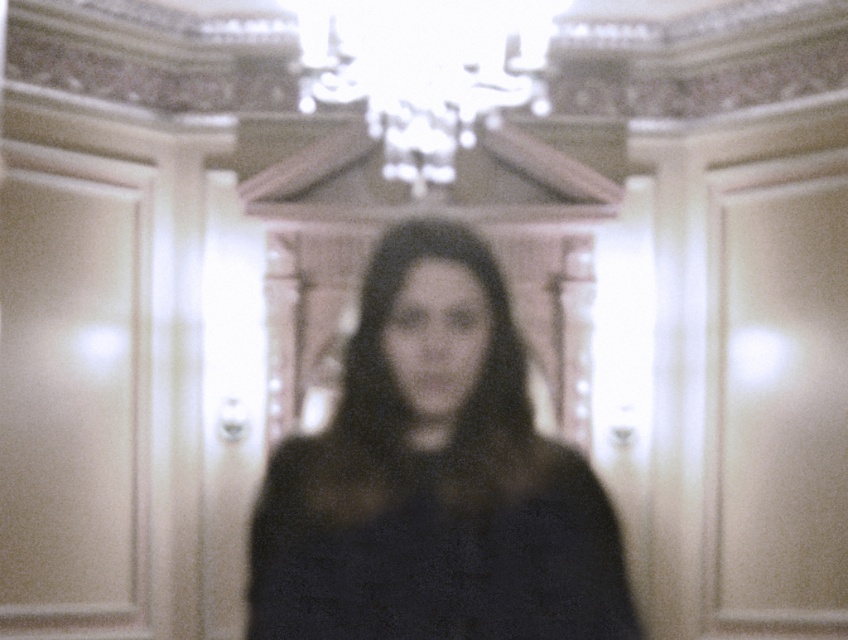
You are a fashion designer observing the image. You need to determine if the black matte dress at center can be displayed under the white glass chandelier at upper center without touching it. The minimum required distance between the dress and the chandelier is 1 meter. Can you confirm if this requirement is met?

The black matte dress at center has a lesser width compared to white glass chandelier at upper center. However, the description does not provide information about the distance between them. Therefore, it is impossible to confirm if the 1 meter requirement is met based on the given details.

You are a photographer trying to capture a clear shot of the black matte dress at center. The camera you are using has a maximum focus range of 20 meters. Can you successfully focus on the dress?

The black matte dress at center and camera are 20.91 meters apart, which exceeds the camera maximum focus range of 20 meters. Therefore, the camera cannot focus on the dress.